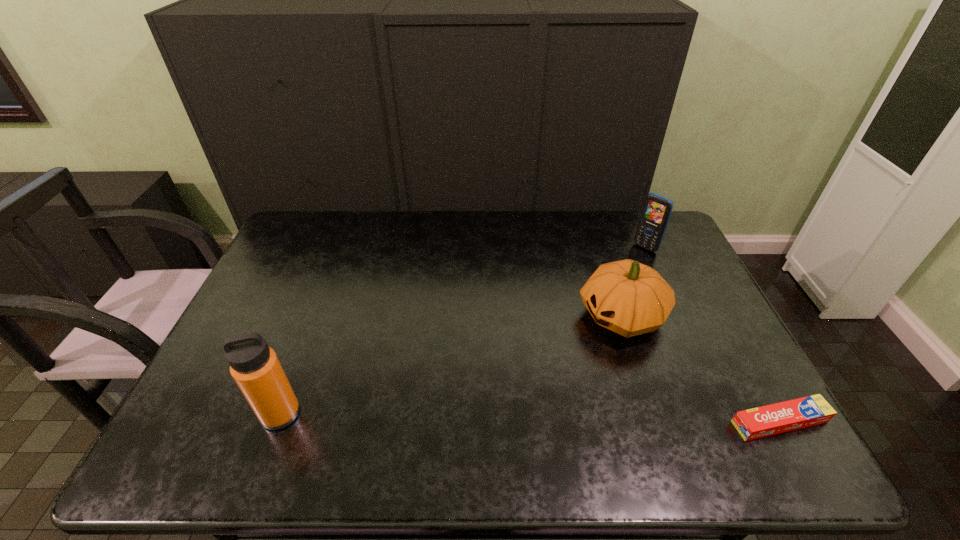
The image size is (960, 540). Identify the location of vacant space on the desktop that is between the tallest object and the toothpaste and is positioned on the side of the gourd with the carved face. (458, 416).

The width and height of the screenshot is (960, 540). Find the location of `vacant space on the desktop that is between the tallest object and the toothpaste and is positioned on the screen of the cellular telephone`. vacant space on the desktop that is between the tallest object and the toothpaste and is positioned on the screen of the cellular telephone is located at coordinates click(x=463, y=416).